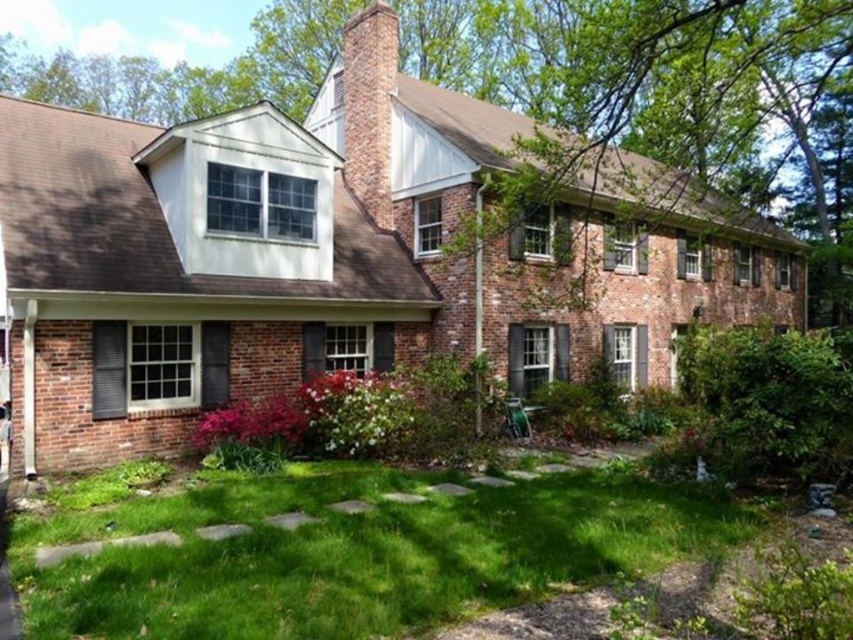
Question: Observing the image, what is the correct spatial positioning of green grass at lower center in reference to brick chimney at center?

Choices:
 (A) below
 (B) above

Answer: (A)

Question: Which point is closer to the camera?

Choices:
 (A) brick chimney at center
 (B) green grass at lower center

Answer: (B)

Question: Is green grass at lower center further to the viewer compared to brick chimney at center?

Choices:
 (A) no
 (B) yes

Answer: (A)

Question: Which object is farther from the camera taking this photo?

Choices:
 (A) green grass at lower center
 (B) brick chimney at center

Answer: (B)

Question: Considering the relative positions of green grass at lower center and brick chimney at center in the image provided, where is green grass at lower center located with respect to brick chimney at center?

Choices:
 (A) left
 (B) right

Answer: (B)